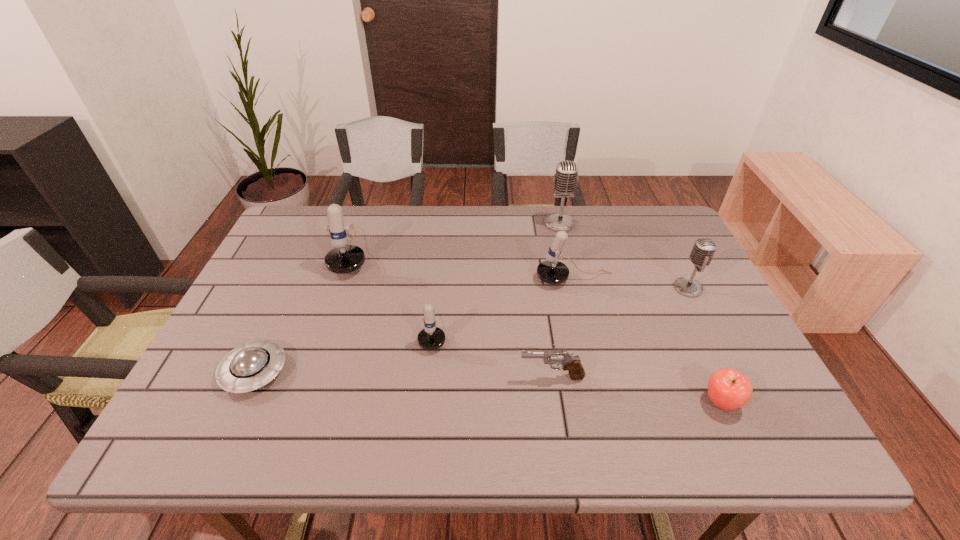
The height and width of the screenshot is (540, 960). In order to click on vacant space at the right edge of the desktop in this screenshot , I will do `click(640, 260)`.

Locate an element on the screen. The image size is (960, 540). vacant region at the far left corner of the desktop is located at coordinates (295, 206).

In the image, there is a desktop. What are the coordinates of `vacant area at the near left corner` in the screenshot? It's located at (219, 428).

Identify the location of vacant space at the near right corner of the desktop. The image size is (960, 540). (750, 440).

At what (x,y) coordinates should I click in order to perform the action: click on vacant region between the apple and the second biggest white microphone. Please return your answer as a coordinate pair (x, y). Looking at the image, I should click on click(x=648, y=341).

Identify the location of unoccupied position between the left gray microphone and the second biggest white microphone. This screenshot has height=540, width=960. (567, 252).

Where is `free area in between the second microphone from left to right and the gray pistol`? Image resolution: width=960 pixels, height=540 pixels. free area in between the second microphone from left to right and the gray pistol is located at coordinates (492, 353).

I want to click on vacant area that lies between the nearest microphone and the pistol, so click(x=492, y=353).

At what (x,y) coordinates should I click in order to perform the action: click on unoccupied position between the right gray microphone and the third object from left to right. Please return your answer as a coordinate pair (x, y). Image resolution: width=960 pixels, height=540 pixels. Looking at the image, I should click on (561, 308).

You are a GUI agent. You are given a task and a screenshot of the screen. Output one action in this format:
    pyautogui.click(x=<x>, y=<y>)
    Task: Click on the vacant area that lies between the rightmost microphone and the left gray microphone
    The width and height of the screenshot is (960, 540).
    Given the screenshot: What is the action you would take?
    (624, 256)